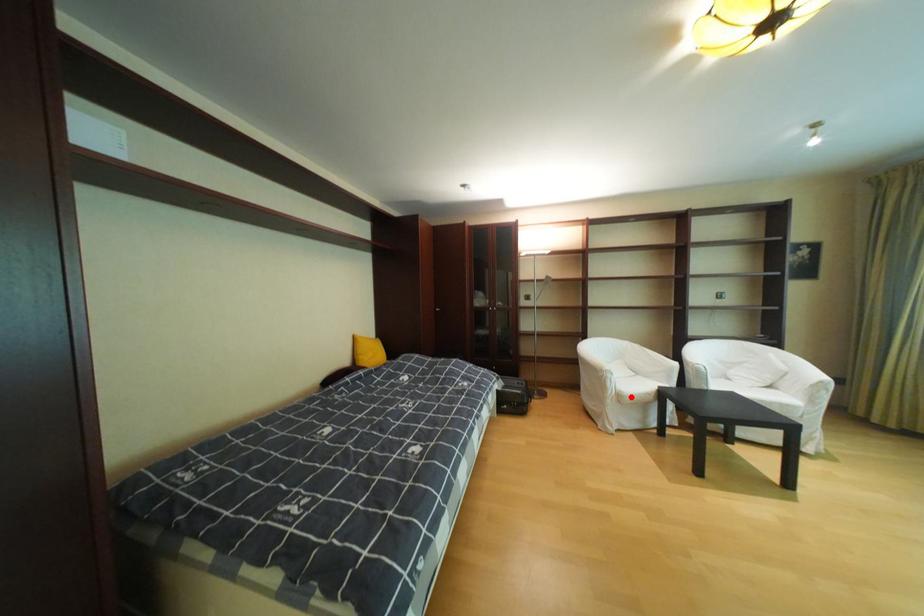
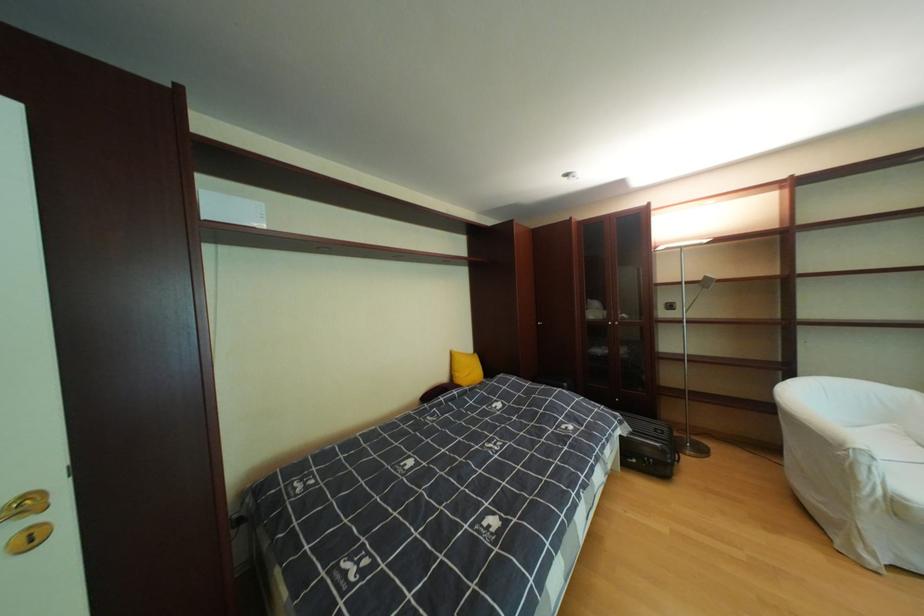
The point at the highlighted location is marked in the first image. Where is the corresponding point in the second image?

(908, 506)